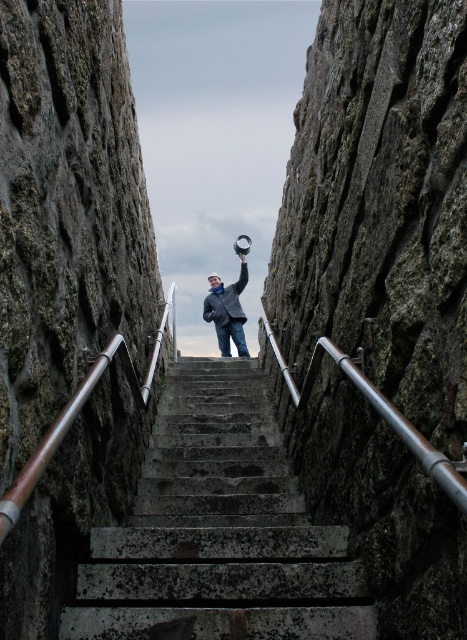
Question: Which object is closer to the camera taking this photo?

Choices:
 (A) satin silver railing at center
 (B) concrete stairs at center
 (C) matte black jacket at center

Answer: (A)

Question: Among these points, which one is farthest from the camera?

Choices:
 (A) (220, 448)
 (B) (437, 456)

Answer: (A)

Question: Can you confirm if satin silver railing at center is positioned to the right of matte black jacket at center?

Choices:
 (A) yes
 (B) no

Answer: (A)

Question: Based on their relative distances, which object is farther from the satin silver railing at center?

Choices:
 (A) concrete stairs at center
 (B) matte black jacket at center

Answer: (B)

Question: Can you confirm if satin silver railing at center is bigger than matte black jacket at center?

Choices:
 (A) yes
 (B) no

Answer: (B)

Question: Is satin silver railing at center below matte black jacket at center?

Choices:
 (A) no
 (B) yes

Answer: (B)